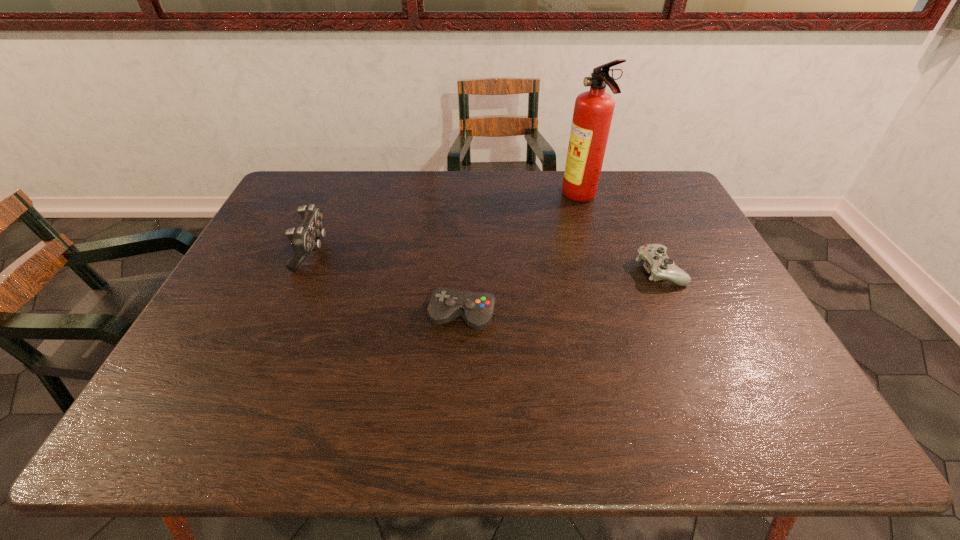
The width and height of the screenshot is (960, 540). Identify the location of free space that satisfies the following two spatial constraints: 1. on the front-facing side of the farthest object; 2. on the front side of the second control from left to right. (616, 316).

Locate an element on the screen. vacant space that satisfies the following two spatial constraints: 1. on the front-facing side of the rightmost object; 2. on the left side of the fire extinguisher is located at coordinates pyautogui.click(x=603, y=269).

This screenshot has height=540, width=960. I want to click on free point that satisfies the following two spatial constraints: 1. on the surface of the rightmost object with buttons; 2. on the left side of the leftmost control, so click(x=304, y=269).